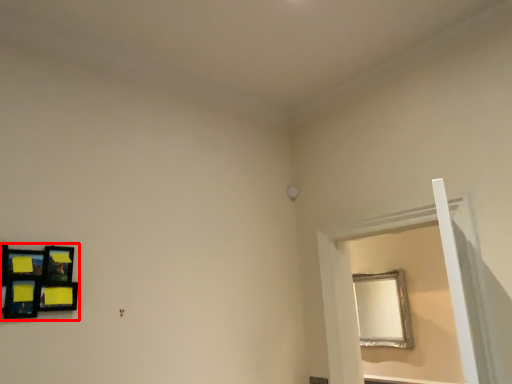
Question: Observing the image, what is the correct spatial positioning of picture frame (annotated by the red box) in reference to window frame?

Choices:
 (A) left
 (B) right

Answer: (A)